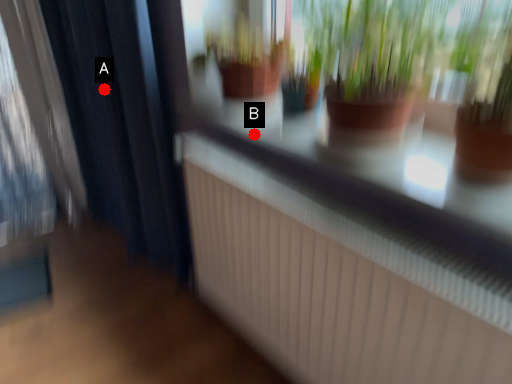
Question: Two points are circled on the image, labeled by A and B beside each circle. Among these points, which one is farthest from the camera?

Choices:
 (A) A is further
 (B) B is further

Answer: (A)